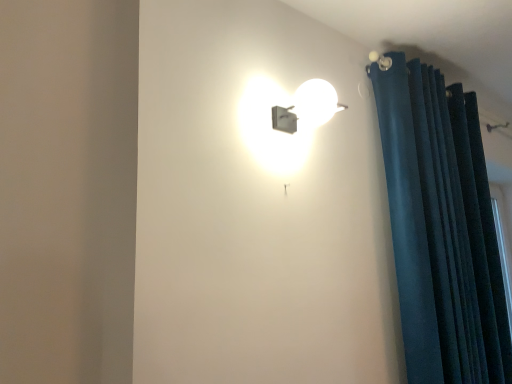
What do you see at coordinates (441, 227) in the screenshot?
I see `dark blue velvet curtain at right` at bounding box center [441, 227].

In order to face dark blue velvet curtain at right, should I rotate leftwards or rightwards?

You should rotate right by 24.254 degrees.

Find the location of a particular element. Image resolution: width=512 pixels, height=384 pixels. dark blue velvet curtain at right is located at coordinates (441, 227).

Locate an element on the screen. The height and width of the screenshot is (384, 512). matte white lamp at upper center is located at coordinates (307, 107).

What do you see at coordinates (307, 107) in the screenshot? I see `matte white lamp at upper center` at bounding box center [307, 107].

What is the approximate width of matte white lamp at upper center?

25.19 centimeters.

Where is `dark blue velvet curtain at right`? This screenshot has width=512, height=384. dark blue velvet curtain at right is located at coordinates (441, 227).

Based on their positions, is matte white lamp at upper center located to the left or right of dark blue velvet curtain at right?

Based on their positions, matte white lamp at upper center is located to the left of dark blue velvet curtain at right.

Looking at this image, is matte white lamp at upper center in front of or behind dark blue velvet curtain at right in the image?

In the image, matte white lamp at upper center appears in front of dark blue velvet curtain at right.

Which point is more forward, (316, 125) or (417, 117)?

Positioned in front is point (316, 125).

From the image's perspective, is matte white lamp at upper center on top of dark blue velvet curtain at right?

Yes, from the image's perspective, matte white lamp at upper center is on top of dark blue velvet curtain at right.

From a real-world perspective, is matte white lamp at upper center physically above dark blue velvet curtain at right?

Yes.

Between matte white lamp at upper center and dark blue velvet curtain at right, which one has smaller width?

dark blue velvet curtain at right.

Is matte white lamp at upper center taller than dark blue velvet curtain at right?

No.

Does matte white lamp at upper center have a larger size compared to dark blue velvet curtain at right?

No.

Is matte white lamp at upper center inside or outside of dark blue velvet curtain at right?

matte white lamp at upper center is not inside dark blue velvet curtain at right, it's outside.

Would you say matte white lamp at upper center is a long distance from dark blue velvet curtain at right?

matte white lamp at upper center is actually quite close to dark blue velvet curtain at right.

Is matte white lamp at upper center aimed at dark blue velvet curtain at right?

No, matte white lamp at upper center is not aimed at dark blue velvet curtain at right.

At what (x,y) coordinates should I click in order to perform the action: click on lamp above the dark blue velvet curtain at right (from a real-world perspective). Please return your answer as a coordinate pair (x, y). The height and width of the screenshot is (384, 512). Looking at the image, I should click on (307, 107).

Which object is positioned more to the right, dark blue velvet curtain at right or matte white lamp at upper center?

Positioned to the right is dark blue velvet curtain at right.

Is dark blue velvet curtain at right in front of matte white lamp at upper center?

No, dark blue velvet curtain at right is further to the viewer.

Considering the positions of point (381, 74) and point (326, 115), is point (381, 74) closer or farther from the camera than point (326, 115)?

Point (381, 74) appears to be farther away from the viewer than point (326, 115).

From the image's perspective, would you say dark blue velvet curtain at right is shown under matte white lamp at upper center?

Yes.

From a real-world perspective, who is located higher, dark blue velvet curtain at right or matte white lamp at upper center?

matte white lamp at upper center.

Which of these two, dark blue velvet curtain at right or matte white lamp at upper center, is wider?

With larger width is matte white lamp at upper center.

Considering the sizes of objects dark blue velvet curtain at right and matte white lamp at upper center in the image provided, who is taller, dark blue velvet curtain at right or matte white lamp at upper center?

dark blue velvet curtain at right.

Does dark blue velvet curtain at right have a smaller size compared to matte white lamp at upper center?

No.

Is dark blue velvet curtain at right inside the boundaries of matte white lamp at upper center, or outside?

dark blue velvet curtain at right cannot be found inside matte white lamp at upper center.

Is dark blue velvet curtain at right next to matte white lamp at upper center?

No, dark blue velvet curtain at right is not making contact with matte white lamp at upper center.

Is dark blue velvet curtain at right facing towards matte white lamp at upper center?

No, dark blue velvet curtain at right is not facing towards matte white lamp at upper center.

In the scene shown: Can you tell me how much dark blue velvet curtain at right and matte white lamp at upper center differ in facing direction?

1.53 degrees.

Measure the distance from dark blue velvet curtain at right to matte white lamp at upper center.

dark blue velvet curtain at right and matte white lamp at upper center are 73.29 centimeters apart.

Locate an element on the screen. This screenshot has height=384, width=512. lamp lying on the left of dark blue velvet curtain at right is located at coordinates (307, 107).

This screenshot has height=384, width=512. I want to click on lamp located in front of the dark blue velvet curtain at right, so click(307, 107).

Identify the location of lamp above the dark blue velvet curtain at right (from the image's perspective). (307, 107).